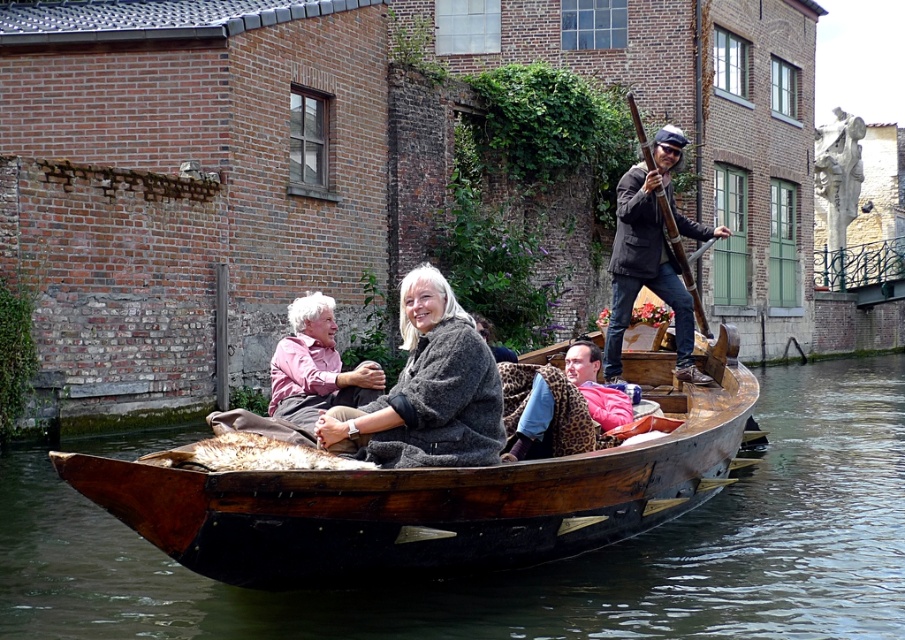
Question: Which object is the closest to the matte pink shirt at center?

Choices:
 (A) fuzzy gray sweater at center
 (B) wooden canoe at center

Answer: (A)

Question: Can you confirm if wooden canoe at center is positioned to the right of leopard print jacket at center?

Choices:
 (A) no
 (B) yes

Answer: (A)

Question: Estimate the real-world distances between objects in this image. Which object is closer to the dark brown leather jacket at upper right?

Choices:
 (A) matte pink shirt at center
 (B) wooden canoe at center
 (C) fuzzy gray sweater at center

Answer: (B)

Question: Does wooden canoe at center come in front of dark brown leather jacket at upper right?

Choices:
 (A) no
 (B) yes

Answer: (B)

Question: Is wooden canoe at center smaller than matte pink shirt at center?

Choices:
 (A) yes
 (B) no

Answer: (B)

Question: Which object is farther from the camera taking this photo?

Choices:
 (A) fuzzy gray sweater at center
 (B) dark brown leather jacket at upper right

Answer: (B)